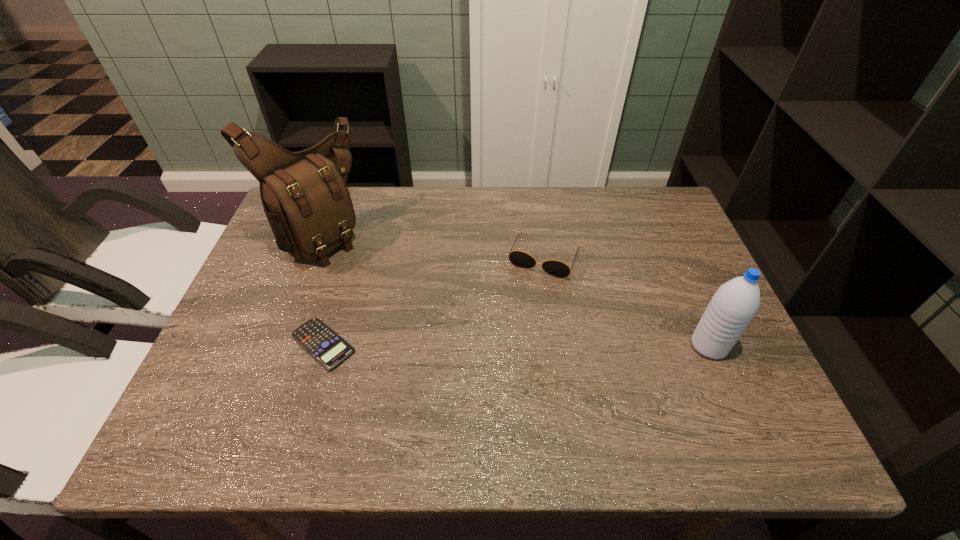
At what (x,y) coordinates should I click in order to perform the action: click on the shortest object. Please return your answer as a coordinate pair (x, y). Looking at the image, I should click on (329, 349).

This screenshot has width=960, height=540. Identify the location of water bottle. (733, 306).

Identify the location of the rightmost object. This screenshot has height=540, width=960. (733, 306).

Find the location of a particular element. This screenshot has width=960, height=540. shoulder bag is located at coordinates (304, 196).

What are the coordinates of `sunglasses` in the screenshot? It's located at (521, 259).

Where is `the second shortest object`? This screenshot has height=540, width=960. the second shortest object is located at coordinates (521, 259).

You are a GUI agent. You are given a task and a screenshot of the screen. Output one action in this format:
    pyautogui.click(x=<x>, y=<y>)
    Task: Click on the free space located 0.150m on the right of the shortest object
    The height and width of the screenshot is (540, 960).
    Given the screenshot: What is the action you would take?
    pyautogui.click(x=422, y=344)

You are a GUI agent. You are given a task and a screenshot of the screen. Output one action in this format:
    pyautogui.click(x=<x>, y=<y>)
    Task: Click on the vacant space located 0.060m on the front of the rightmost object
    
    Given the screenshot: What is the action you would take?
    pyautogui.click(x=726, y=386)

Identify the location of free location located 0.380m on the front-facing side of the tallest object. (452, 326).

This screenshot has width=960, height=540. In order to click on vacant space situated 0.330m on the front-facing side of the tallest object in this screenshot , I will do `click(437, 316)`.